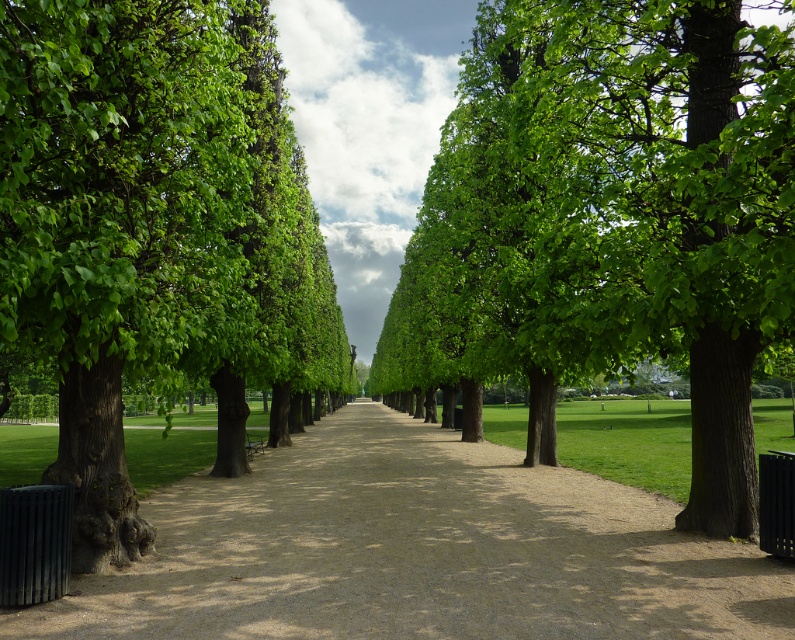
Does brown gravel path at center have a lesser width compared to wooden park bench at center?

No, brown gravel path at center is not thinner than wooden park bench at center.

Locate an element on the screen. brown gravel path at center is located at coordinates (417, 552).

Can you confirm if green leafy tree at left is taller than brown gravel path at center?

Correct, green leafy tree at left is much taller as brown gravel path at center.

Which is in front, point (278, 96) or point (664, 556)?

Point (664, 556) is in front.

The height and width of the screenshot is (640, 795). I want to click on green leafy tree at left, so click(149, 224).

Locate an element on the screen. This screenshot has width=795, height=640. green leafy tree at left is located at coordinates (149, 224).

Is green leafy tree at center closer to camera compared to green leafy tree at left?

No, green leafy tree at center is further to the viewer.

Between green leafy tree at center and green leafy tree at left, which one appears on the left side from the viewer's perspective?

green leafy tree at left is more to the left.

Who is more forward, (516, 156) or (285, 337)?

Point (516, 156) is in front.

At what (x,y) coordinates should I click in order to perform the action: click on green leafy tree at center. Please return your answer as a coordinate pair (x, y). Looking at the image, I should click on (611, 220).